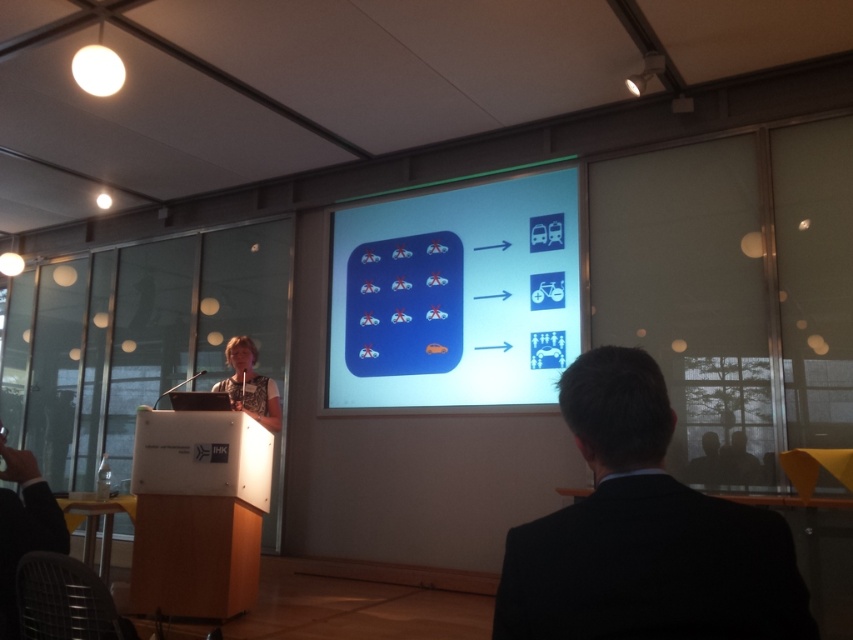
You are a speaker at the conference and want to check if the white glossy projection screen at center is visible from your position behind the podium. Since the screen is located at point (456, 296), can you see it clearly?

The white glossy projection screen at center is located at point (456, 296), which is directly in front of the podium. Therefore, the speaker can see it clearly from their position behind the podium.

Based on the photo, you are an attendee at the presentation and want to take a photo of the speaker and the screen. Since you want both the black suit at center and the white glossy projection screen at center in the frame, where should you position yourself relative to them?

You should position yourself in front of both the black suit at center and the white glossy projection screen at center so that the speaker is below the screen in the photo, ensuring both are visible in the frame.